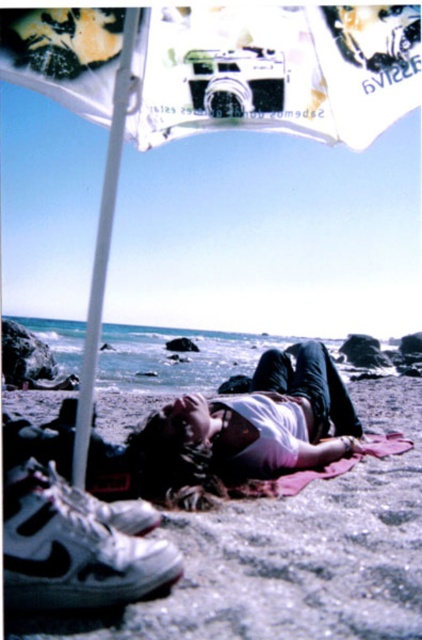
Question: Can you confirm if smooth sand at lower center is positioned above pink fabric at lower center?

Choices:
 (A) no
 (B) yes

Answer: (A)

Question: Which point is farther to the camera?

Choices:
 (A) smooth sand at lower center
 (B) pink fabric at lower center

Answer: (A)

Question: Does smooth sand at lower center lie in front of pink fabric at lower center?

Choices:
 (A) yes
 (B) no

Answer: (B)

Question: Which of the following is the closest to the observer?

Choices:
 (A) smooth sand at lower center
 (B) pink fabric at lower center

Answer: (B)

Question: Can you confirm if smooth sand at lower center is positioned to the left of pink fabric at lower center?

Choices:
 (A) yes
 (B) no

Answer: (B)